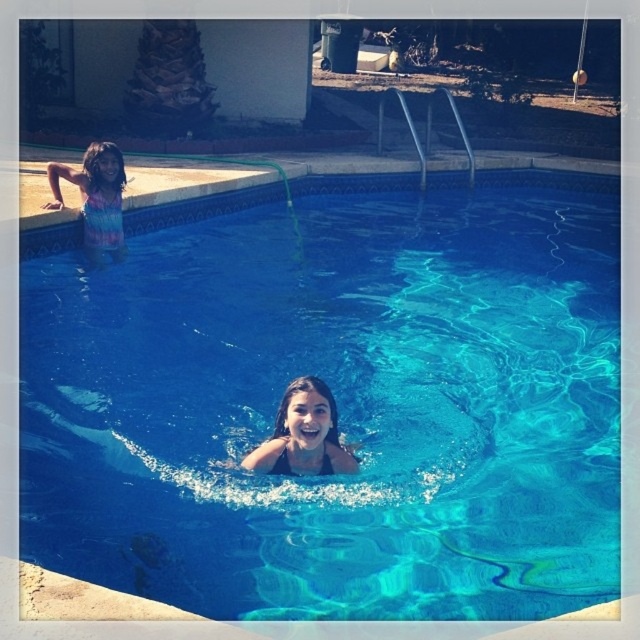
Question: Does transparent blue water at center have a greater width compared to smooth skin child at center?

Choices:
 (A) yes
 (B) no

Answer: (A)

Question: Can you confirm if smooth skin child at center is positioned to the right of tie-dye fabric at upper left?

Choices:
 (A) no
 (B) yes

Answer: (B)

Question: Which point is closer to the camera?

Choices:
 (A) transparent blue water at center
 (B) smooth skin child at center

Answer: (A)

Question: Which point is farther to the camera?

Choices:
 (A) transparent blue water at center
 (B) smooth skin child at center

Answer: (B)

Question: Is smooth skin child at center smaller than tie-dye fabric at upper left?

Choices:
 (A) yes
 (B) no

Answer: (A)

Question: Which point is farther to the camera?

Choices:
 (A) tie-dye fabric at upper left
 (B) smooth skin child at center
 (C) transparent blue water at center

Answer: (A)